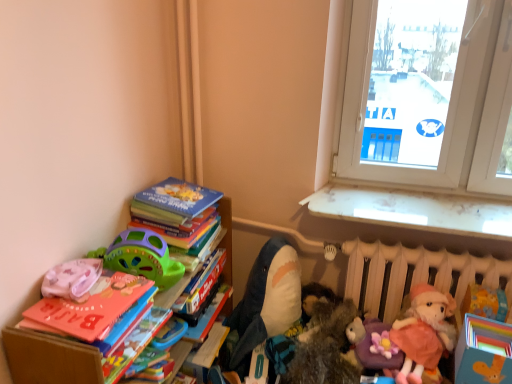
Question: Is soft plush shark at center, which is counted as the 3th toy, starting from the left, situated inside pink fabric pillow at left, which is counted as the 6th toy, starting from the right, or outside?

Choices:
 (A) outside
 (B) inside

Answer: (A)

Question: Is soft plush shark at center, which is counted as the 3th toy, starting from the left, bigger or smaller than pink fabric pillow at left, which is the 1th toy in left-to-right order?

Choices:
 (A) big
 (B) small

Answer: (A)

Question: Which object is positioned closest to the wooden bookcase at left?

Choices:
 (A) hardcover book at center, which is counted as the second book, starting from the bottom
 (B) purple plush toy at lower right, the 2th toy viewed from the right
 (C) pink fabric pillow at left, which is the 1th toy in left-to-right order
 (D) white matte radiator at lower right
 (E) hardcover book at lower left, the third book from the top

Answer: (E)

Question: Estimate the real-world distances between objects in this image. Which object is closer to the hardcover book at lower left, which appears as the 1th book when ordered from the bottom?

Choices:
 (A) pink fabric pillow at left, which is the 1th toy in left-to-right order
 (B) purple plush toy at lower right, acting as the 5th toy starting from the left
 (C) hardcover books at upper left, placed as the first book when sorted from top to bottom
 (D) wooden bookcase at left
 (E) fuzzy brown stuffed animal at center, the 3th toy in the right-to-left sequence

Answer: (D)